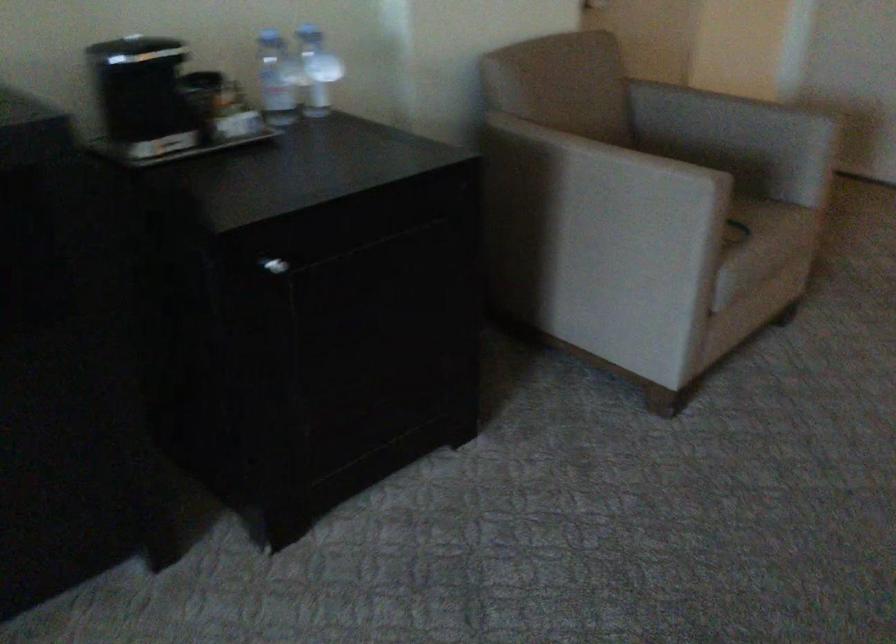
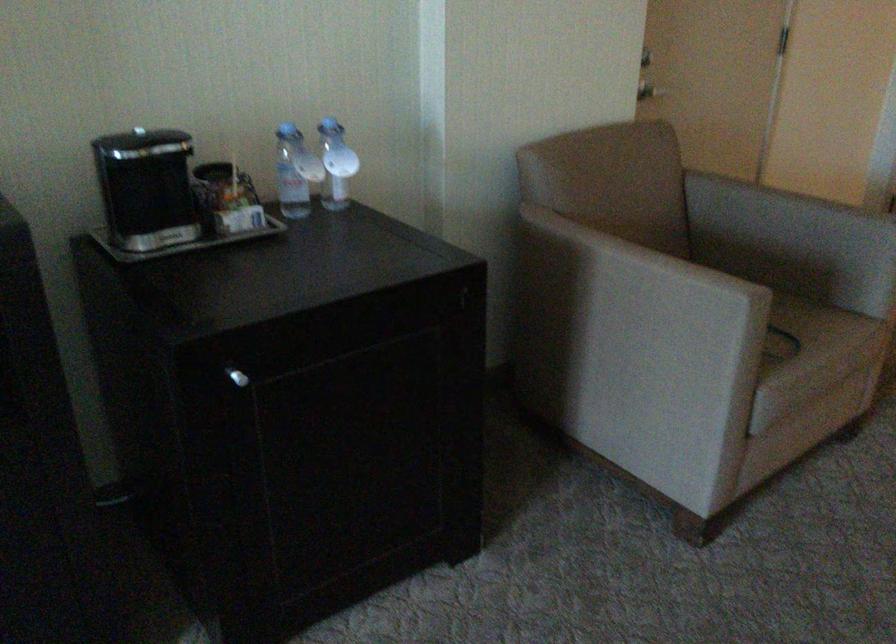
Where in the second image is the point corresponding to the point at 754,225 from the first image?

(811, 335)